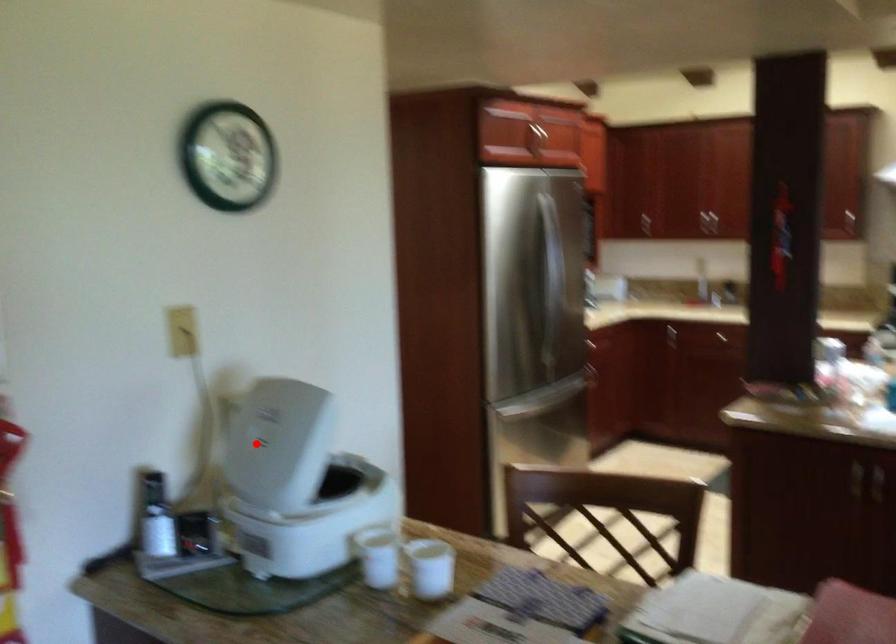
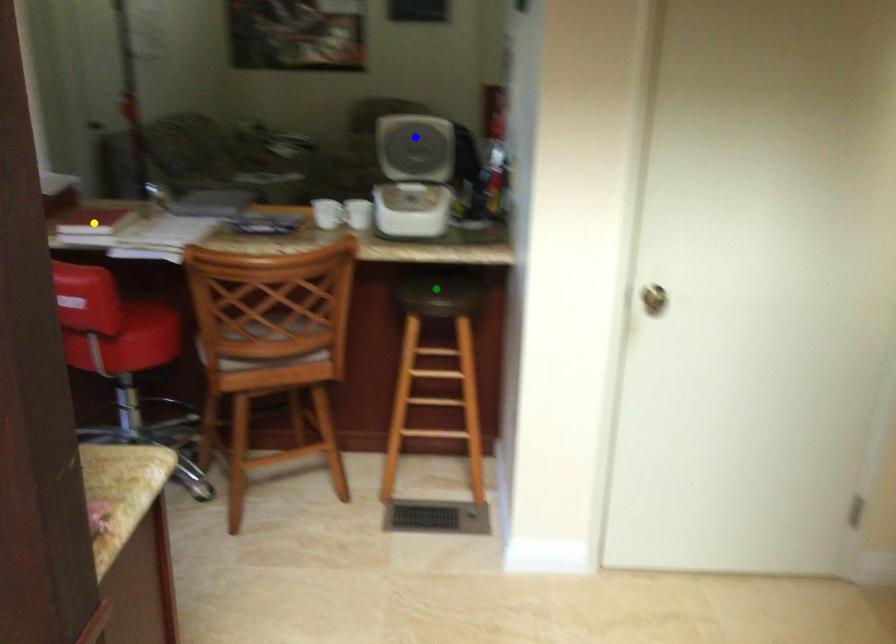
Question: I am providing you with two images of the same scene from different viewpoints. A red point is marked on the first image. You are given multiple points on the second image. Which mark in image 2 goes with the point in image 1?

Choices:
 (A) yellow point
 (B) blue point
 (C) green point

Answer: (B)